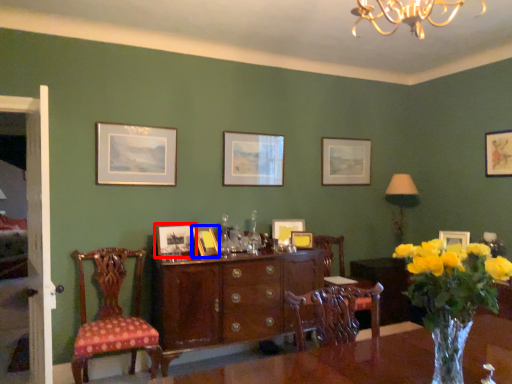
Question: Among these objects, which one is nearest to the camera, picture frame (highlighted by a red box) or picture frame (highlighted by a blue box)?

Choices:
 (A) picture frame
 (B) picture frame

Answer: (B)